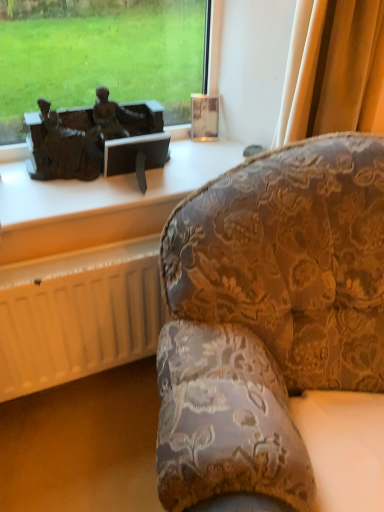
I want to click on empty space that is ontop of white matte radiator at lower left, so click(x=77, y=260).